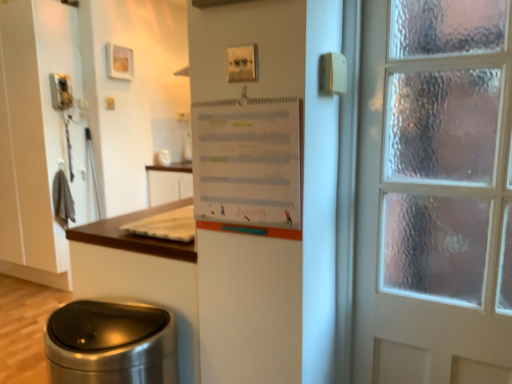
Locate an element on the screen. polished stainless steel trash can at lower left is located at coordinates (111, 344).

Describe the element at coordinates (111, 344) in the screenshot. I see `polished stainless steel trash can at lower left` at that location.

Where is `white paper at upper center`? The image size is (512, 384). white paper at upper center is located at coordinates coord(247,161).

The height and width of the screenshot is (384, 512). Describe the element at coordinates (247, 161) in the screenshot. I see `white paper at upper center` at that location.

Identify the location of polished stainless steel trash can at lower left. This screenshot has height=384, width=512. (111, 344).

Can you confirm if polished stainless steel trash can at lower left is positioned to the right of white paper at upper center?

In fact, polished stainless steel trash can at lower left is to the left of white paper at upper center.

From the picture: Which object is further away from the camera, polished stainless steel trash can at lower left or white paper at upper center?

polished stainless steel trash can at lower left is behind.

Is point (83, 307) positioned in front of point (220, 107)?

No, it is behind (220, 107).

From the image's perspective, between polished stainless steel trash can at lower left and white paper at upper center, which one is located above?

From the image's view, white paper at upper center is above.

From a real-world perspective, is polished stainless steel trash can at lower left physically located above or below white paper at upper center?

polished stainless steel trash can at lower left is situated lower than white paper at upper center in the real world.

Considering the sizes of polished stainless steel trash can at lower left and white paper at upper center in the image, is polished stainless steel trash can at lower left wider or thinner than white paper at upper center?

In the image, polished stainless steel trash can at lower left appears to be wider than white paper at upper center.

Is polished stainless steel trash can at lower left shorter than white paper at upper center?

In fact, polished stainless steel trash can at lower left may be taller than white paper at upper center.

Does polished stainless steel trash can at lower left have a smaller size compared to white paper at upper center?

No, polished stainless steel trash can at lower left is not smaller than white paper at upper center.

Is polished stainless steel trash can at lower left not inside white paper at upper center?

Yes.

Does polished stainless steel trash can at lower left touch white paper at upper center?

There is a gap between polished stainless steel trash can at lower left and white paper at upper center.

Is polished stainless steel trash can at lower left oriented towards white paper at upper center?

No, polished stainless steel trash can at lower left is not facing towards white paper at upper center.

What's the angular difference between polished stainless steel trash can at lower left and white paper at upper center's facing directions?

4.07 degrees separate the facing orientations of polished stainless steel trash can at lower left and white paper at upper center.

Find the location of a particular element. poster above the polished stainless steel trash can at lower left (from the image's perspective) is located at coordinates (247, 161).

Considering the relative positions of white paper at upper center and polished stainless steel trash can at lower left in the image provided, is white paper at upper center to the left or to the right of polished stainless steel trash can at lower left?

white paper at upper center is positioned on polished stainless steel trash can at lower left's right side.

Which is behind, white paper at upper center or polished stainless steel trash can at lower left?

polished stainless steel trash can at lower left is behind.

Is point (298, 111) farther from camera compared to point (74, 352)?

That is False.

From the image's perspective, between white paper at upper center and polished stainless steel trash can at lower left, who is located below?

polished stainless steel trash can at lower left.

From a real-world perspective, is white paper at upper center located beneath polished stainless steel trash can at lower left?

No.

Which of these two, white paper at upper center or polished stainless steel trash can at lower left, is wider?

polished stainless steel trash can at lower left.

Considering the sizes of objects white paper at upper center and polished stainless steel trash can at lower left in the image provided, who is shorter, white paper at upper center or polished stainless steel trash can at lower left?

white paper at upper center is shorter.

Between white paper at upper center and polished stainless steel trash can at lower left, which one has larger size?

polished stainless steel trash can at lower left is bigger.

Is white paper at upper center spatially inside polished stainless steel trash can at lower left, or outside of it?

white paper at upper center lies outside polished stainless steel trash can at lower left.

Would you consider white paper at upper center to be distant from polished stainless steel trash can at lower left?

No, white paper at upper center is not far from polished stainless steel trash can at lower left.

Is white paper at upper center positioned with its back to polished stainless steel trash can at lower left?

That's not correct — white paper at upper center is not looking away from polished stainless steel trash can at lower left.

Identify the location of poster in front of the polished stainless steel trash can at lower left. (247, 161).

Locate an element on the screen. This screenshot has width=512, height=384. waste container below the white paper at upper center (from the image's perspective) is located at coordinates (111, 344).

This screenshot has width=512, height=384. Identify the location of waste container located behind the white paper at upper center. (111, 344).